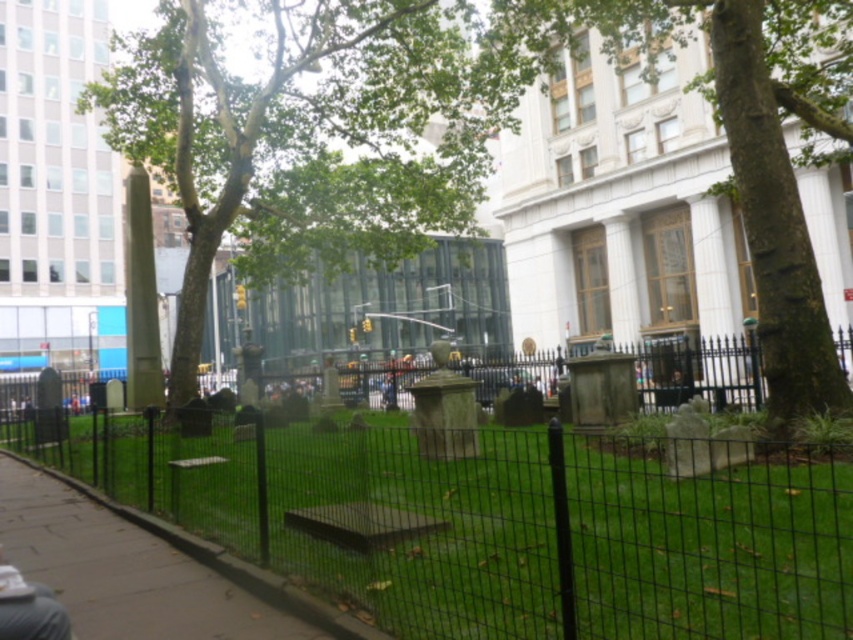
Who is lower down, green textured bark at center or green leafy tree at center?

Positioned lower is green textured bark at center.

Consider the image. Who is more forward, (770, 340) or (463, 228)?

Point (770, 340) is more forward.

This screenshot has width=853, height=640. I want to click on green textured bark at center, so click(693, 176).

Who is lower down, green textured bark at center or smooth concrete pavement at lower left?

smooth concrete pavement at lower left is lower down.

Between green textured bark at center and smooth concrete pavement at lower left, which one appears on the left side from the viewer's perspective?

Positioned to the left is smooth concrete pavement at lower left.

Who is more forward, (701, 164) or (90, 579)?

Point (90, 579)

The height and width of the screenshot is (640, 853). Identify the location of green textured bark at center. (693, 176).

Can you confirm if green grass at center is thinner than green leafy tree at center?

Correct, green grass at center's width is less than green leafy tree at center's.

This screenshot has height=640, width=853. Describe the element at coordinates (502, 524) in the screenshot. I see `green grass at center` at that location.

Is point (811, 504) behind point (437, 52)?

That is False.

Locate an element on the screen. Image resolution: width=853 pixels, height=640 pixels. green grass at center is located at coordinates (502, 524).